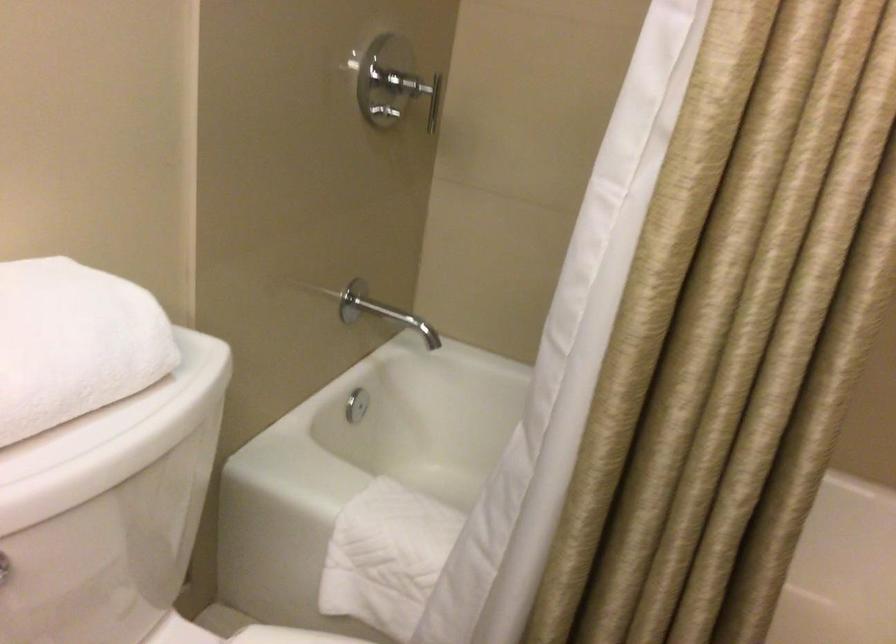
The height and width of the screenshot is (644, 896). What are the coordinates of `toilet flush handle` in the screenshot? It's located at (4, 569).